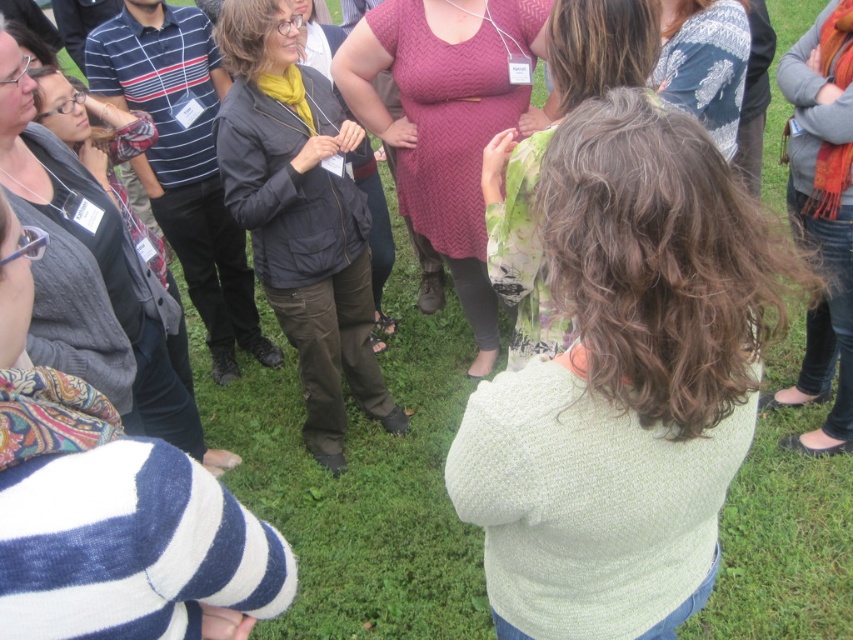
Looking at this image, who is shorter, matte black jacket at center or jeans at lower right?

jeans at lower right is shorter.

The width and height of the screenshot is (853, 640). Describe the element at coordinates (300, 216) in the screenshot. I see `matte black jacket at center` at that location.

Locate an element on the screen. matte black jacket at center is located at coordinates [300, 216].

In the scene shown: Can you confirm if knitted gray sweater at left is thinner than green floral dress at center?

Yes.

Who is shorter, knitted gray sweater at left or green floral dress at center?

With less height is green floral dress at center.

Which is behind, point (74, 204) or point (612, 29)?

The point (74, 204) is behind.

Where is `knitted gray sweater at left`? The height and width of the screenshot is (640, 853). knitted gray sweater at left is located at coordinates (94, 268).

Which is more to the left, light green sweater at center or jeans at lower right?

light green sweater at center is more to the left.

Does point (575, 637) lie in front of point (824, 28)?

That is True.

I want to click on light green sweater at center, so click(625, 381).